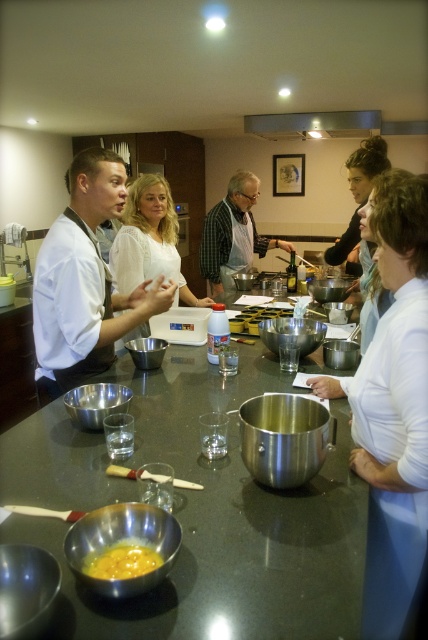
Question: Which of the following is the farthest from the observer?

Choices:
 (A) yellow/yellowish-orange/egg at center
 (B) stainless steel exhaust hood at upper center
 (C) matte black apron at center
 (D) shiny metallic table at center

Answer: (B)

Question: Which of these objects is positioned closest to the matte black apron at center?

Choices:
 (A) stainless steel exhaust hood at upper center
 (B) shiny metallic table at center
 (C) white glossy chef coat at center

Answer: (A)

Question: Among these objects, which one is farthest from the camera?

Choices:
 (A) stainless steel exhaust hood at upper center
 (B) matte black apron at center
 (C) shiny metallic table at center

Answer: (A)

Question: Does matte black apron at center have a greater width compared to yellow/yellowish-orange/egg at center?

Choices:
 (A) yes
 (B) no

Answer: (A)

Question: Is matte black apron at center smaller than stainless steel exhaust hood at upper center?

Choices:
 (A) no
 (B) yes

Answer: (B)

Question: Does matte black apron at center appear on the left side of yellow/yellowish-orange/egg at center?

Choices:
 (A) no
 (B) yes

Answer: (A)